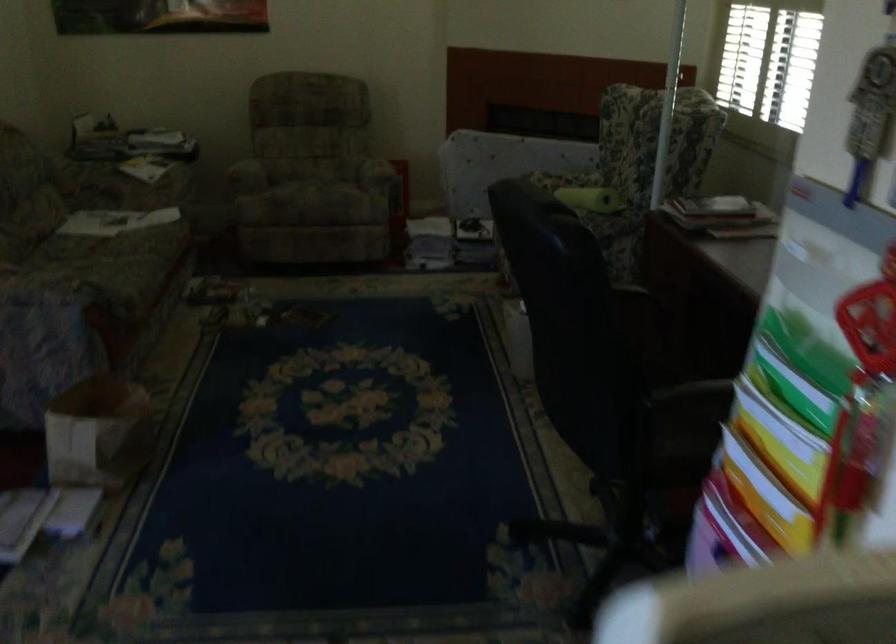
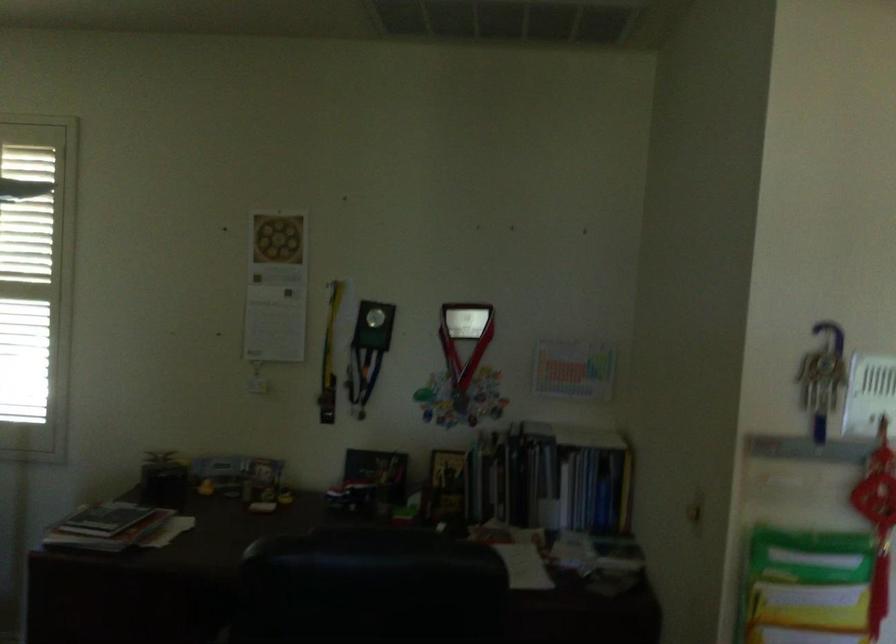
Locate, in the second image, the point that corresponds to point 791,446 in the first image.

(812, 614)